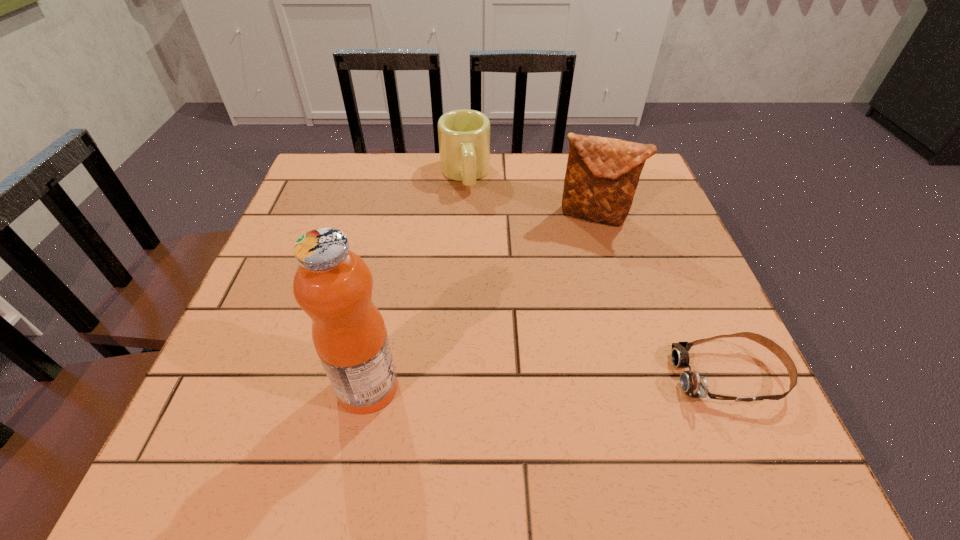
You are a GUI agent. You are given a task and a screenshot of the screen. Output one action in this format:
    pyautogui.click(x=<x>, y=<y>)
    Task: Click on the vacant region that satisfies the following two spatial constraints: 1. on the front side of the clutch bag; 2. on the front-facing side of the shortest object
    The image size is (960, 540).
    Given the screenshot: What is the action you would take?
    pyautogui.click(x=640, y=376)

The height and width of the screenshot is (540, 960). What are the coordinates of `vacant position in the image that satisfies the following two spatial constraints: 1. on the back side of the leftmost object; 2. on the front-facing side of the goggles` in the screenshot? It's located at (371, 376).